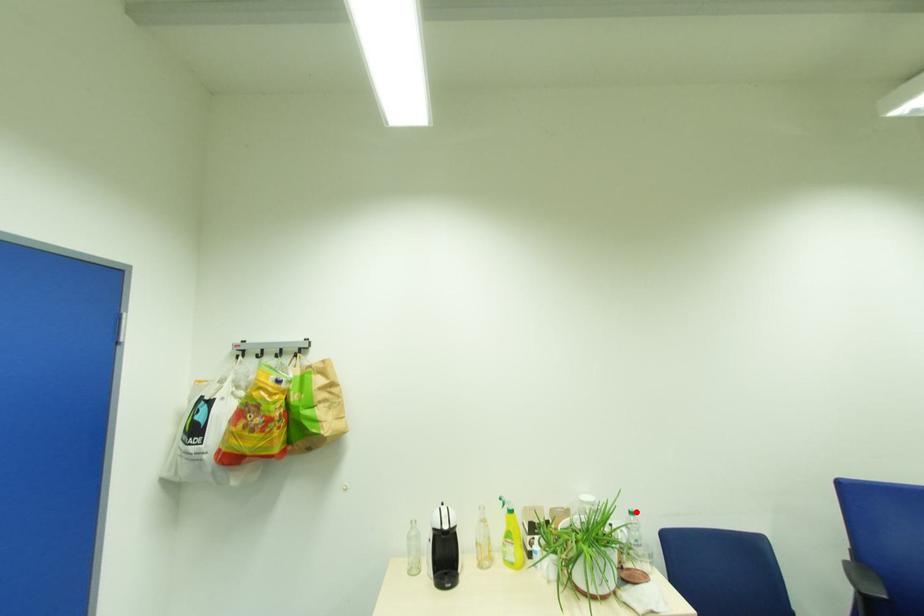
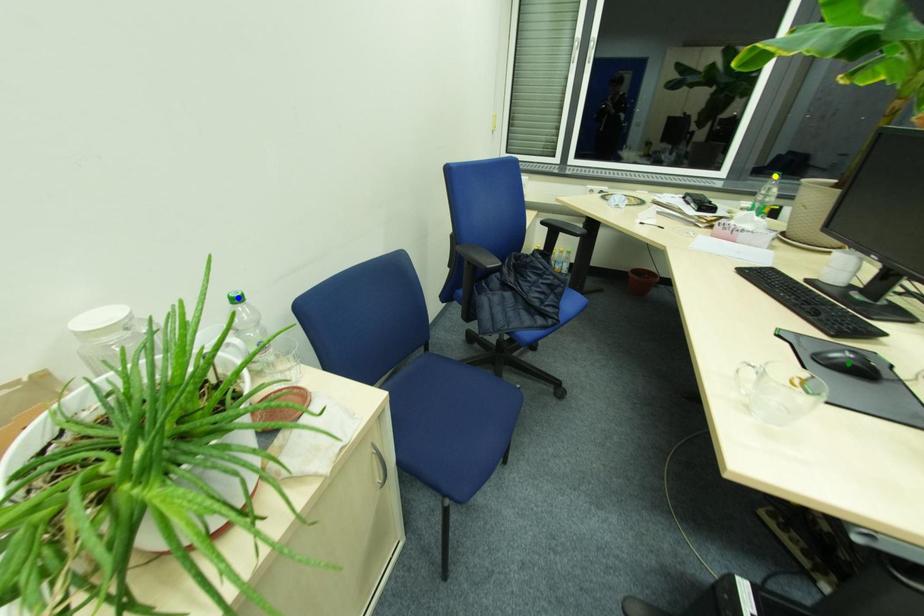
Question: I am providing you with two images of the same scene from different viewpoints. A red point is marked on the first image. You are given multiple points on the second image. Which point in image 2 represents the same 3d spot as the red point in image 1?

Choices:
 (A) yellow point
 (B) green point
 (C) blue point

Answer: (C)